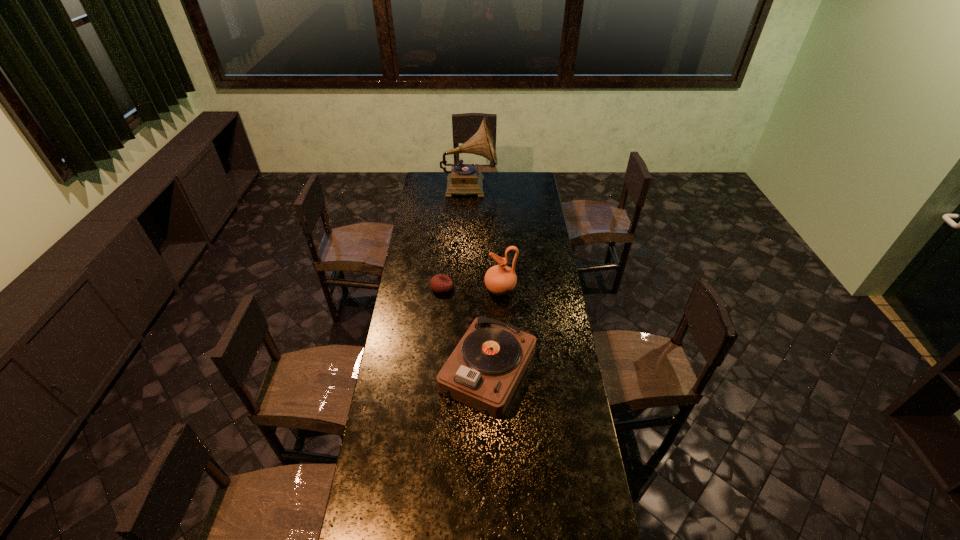
Find the location of a particular element. free space in the image that satisfies the following two spatial constraints: 1. on the spout of the pottery; 2. on the front side of the nearer record player is located at coordinates (504, 372).